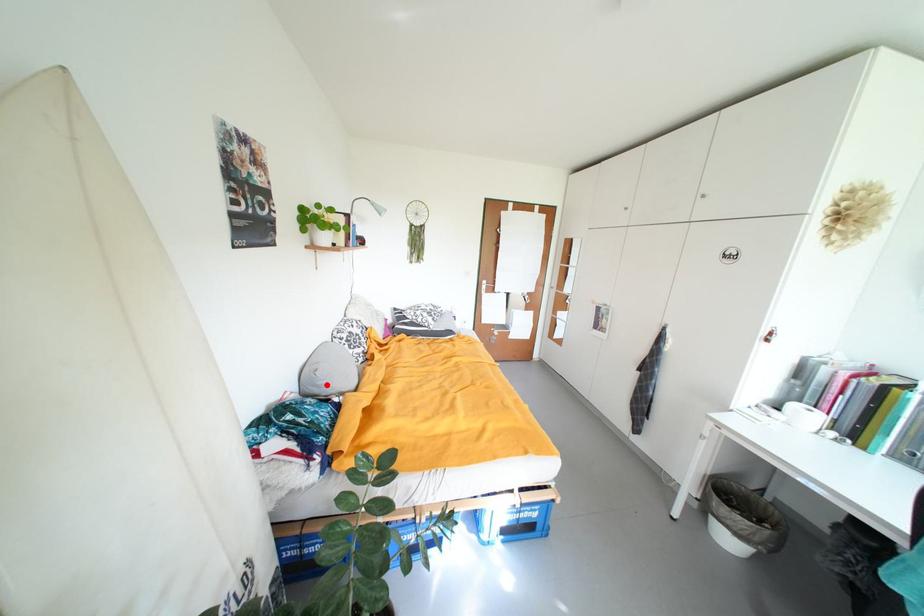
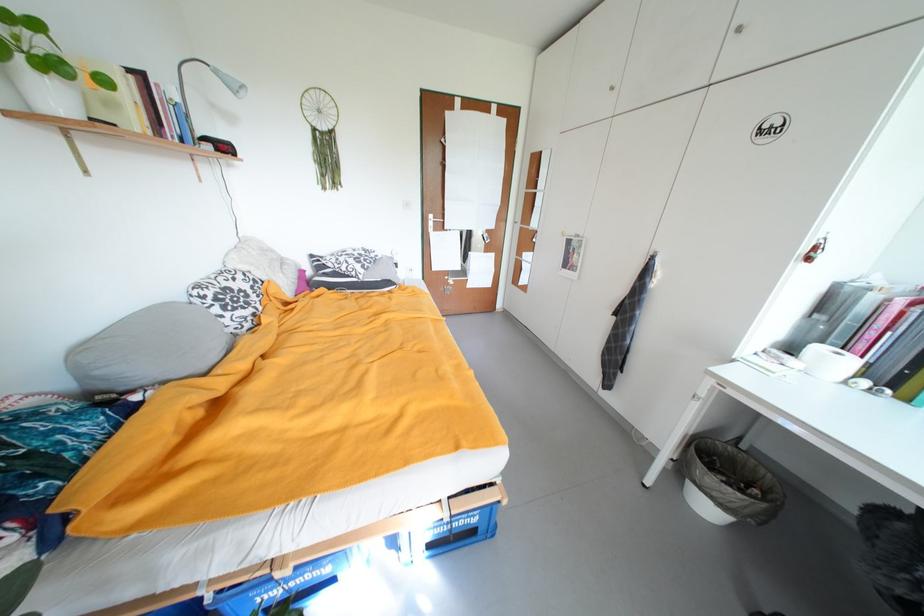
Question: A red point is marked in image1. In image2, is the corresponding 3D point closer to the camera or farther? Reply with the corresponding letter.

Choices:
 (A) The corresponding 3D point is closer.
 (B) The corresponding 3D point is farther.

Answer: (B)